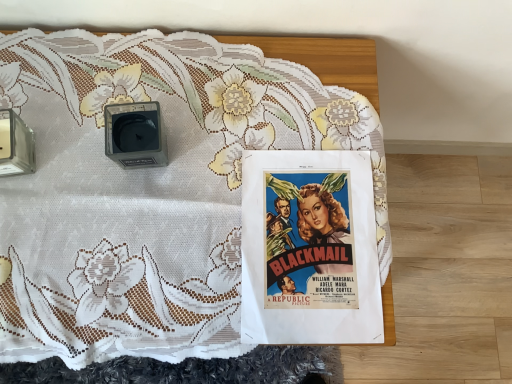
The image size is (512, 384). In order to click on free point behind vivid paper poster at center in this screenshot , I will do click(x=294, y=100).